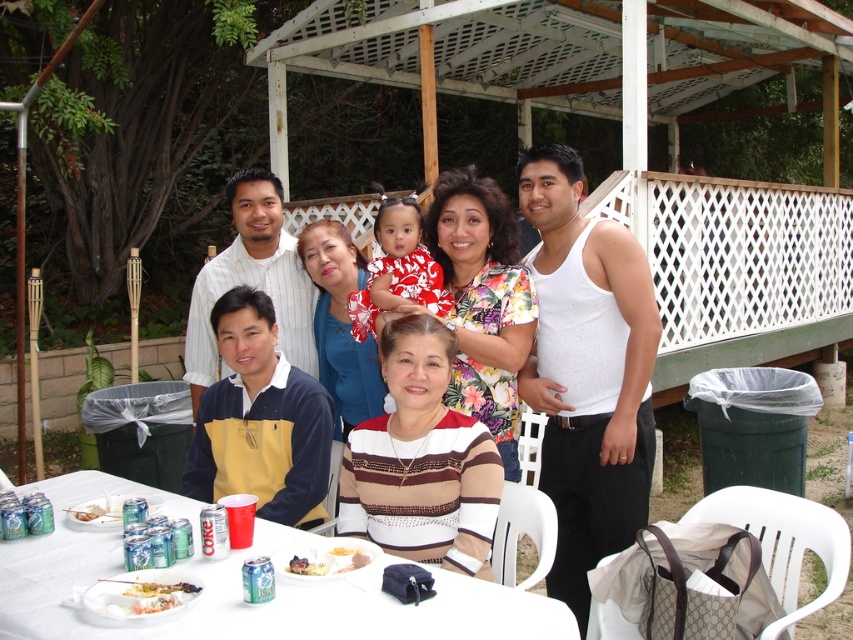
Looking at this image, you are a photographer at the event and want to capture a photo of both the floral fabric dress at upper center and the printed fabric dress at center. Which dress should you focus on first to ensure both are in the frame?

The floral fabric dress at upper center is in front of the printed fabric dress at center, so focus on the floral fabric dress at upper center first to ensure both are in the frame.

You are a photographer taking a picture of the group at the family gathering. You notice a point at coordinates (589, 369). What is this point located on?

The point at coordinates (589, 369) is located on the floral fabric dress at upper center.

You are a photographer at the event and need to decide where to place a large centerpiece. The floral fabric dress at upper center and the white striped shirt at center are in the frame. Which clothing item is wider, and thus requires more space in the composition?

The floral fabric dress at upper center is wider than the white striped shirt at center, so it requires more space in the composition.